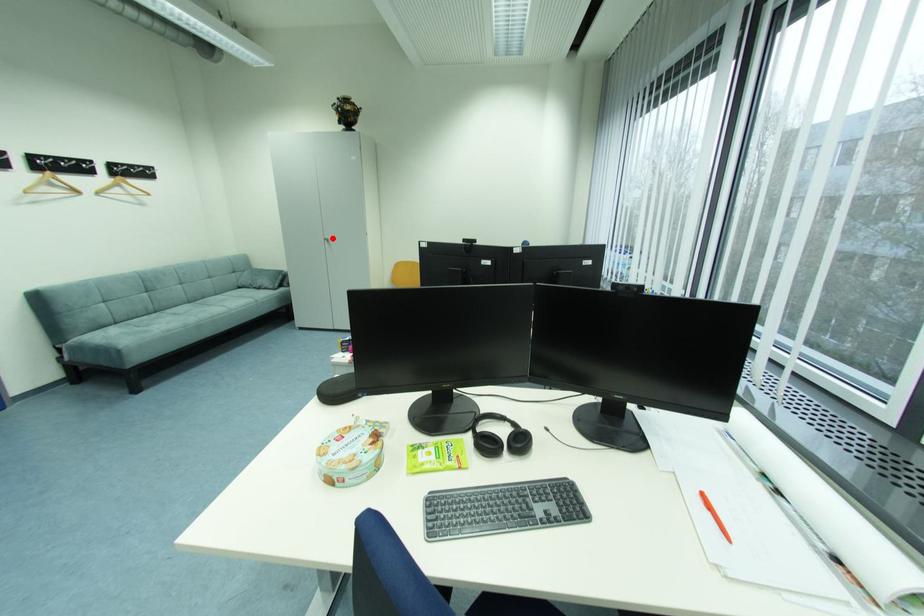
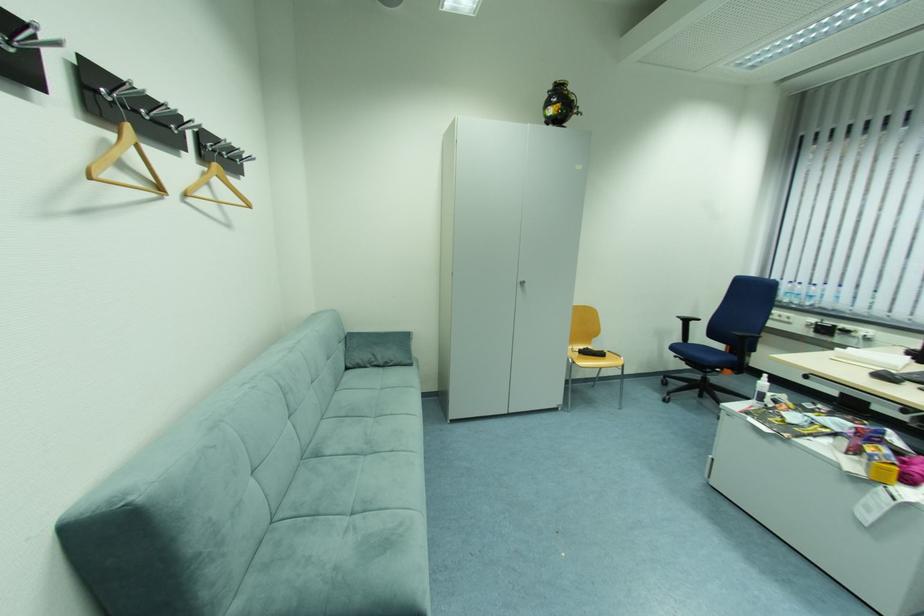
In the second image, find the point that corresponds to the highlighted location in the first image.

(527, 281)